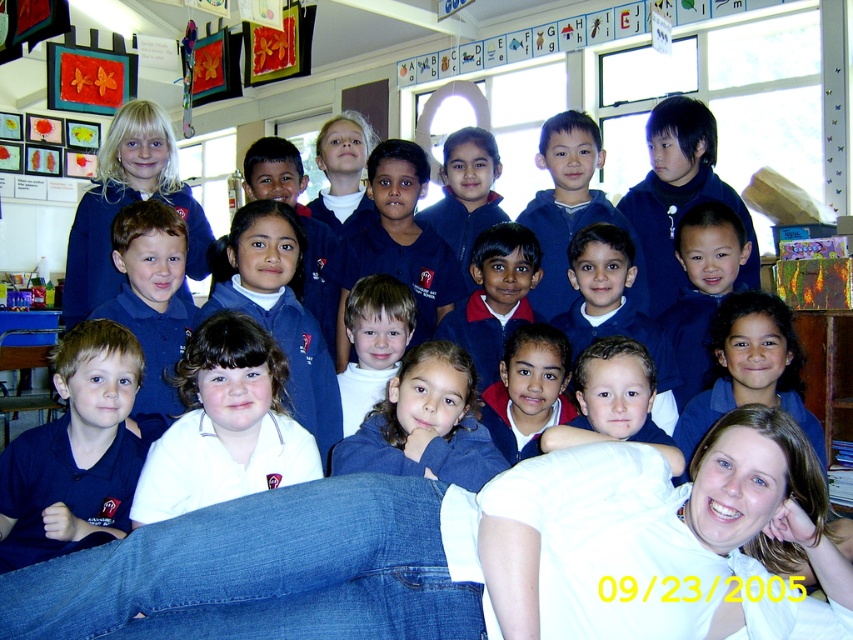
Question: Which point is closer to the camera taking this photo?

Choices:
 (A) (9, 502)
 (B) (186, 218)
 (C) (350, 316)

Answer: (A)

Question: Is matte blue shirt at lower left wider than matte blue uniform at upper left?

Choices:
 (A) yes
 (B) no

Answer: (B)

Question: Is matte blue shirt at lower left positioned in front of white turtleneck sweater at center?

Choices:
 (A) yes
 (B) no

Answer: (A)

Question: Which point is farther from the camera taking this photo?

Choices:
 (A) (376, 310)
 (B) (45, 506)

Answer: (A)

Question: Which object is farther from the camera taking this photo?

Choices:
 (A) matte blue shirt at lower left
 (B) white turtleneck sweater at center

Answer: (B)

Question: Can you confirm if matte blue shirt at lower left is positioned above white turtleneck sweater at center?

Choices:
 (A) no
 (B) yes

Answer: (A)